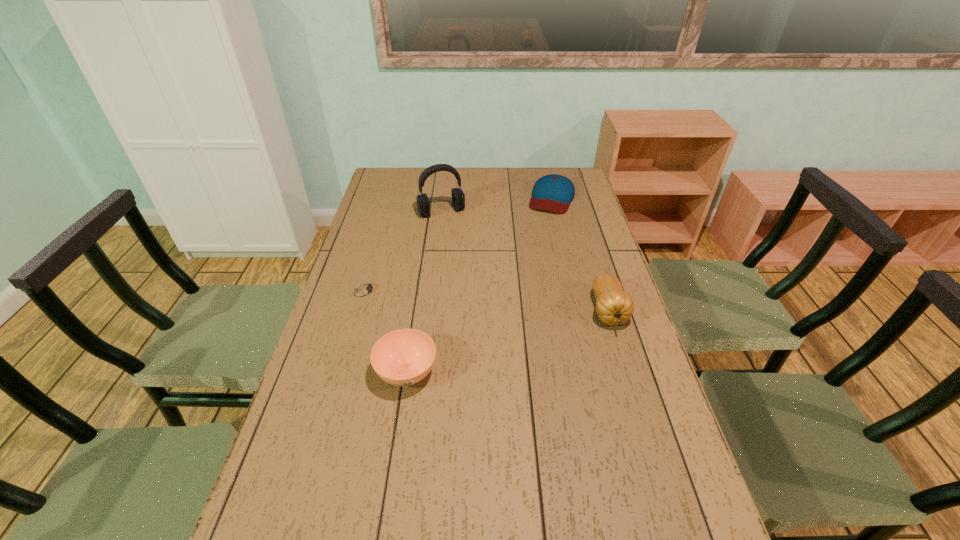
Identify the location of vacant region between the baseball cap and the leftmost object. This screenshot has width=960, height=540. (458, 244).

This screenshot has height=540, width=960. Find the location of `empty space between the watch and the baseball cap`. empty space between the watch and the baseball cap is located at coordinates (458, 244).

This screenshot has height=540, width=960. I want to click on free space between the tallest object and the baseball cap, so click(x=496, y=205).

The width and height of the screenshot is (960, 540). I want to click on vacant space that's between the nearest object and the headset, so click(424, 292).

Find the location of `free space between the nearest object and the tallest object`. free space between the nearest object and the tallest object is located at coordinates (424, 292).

This screenshot has width=960, height=540. I want to click on free space between the watch and the tallest object, so click(x=403, y=251).

Where is `the third closest object to the baseball cap`? the third closest object to the baseball cap is located at coordinates (365, 289).

This screenshot has width=960, height=540. Find the location of `object that stands as the third closest to the tallest object`. object that stands as the third closest to the tallest object is located at coordinates (614, 306).

Identify the location of free point that satisfies the following two spatial constraints: 1. on the front side of the soup bowl; 2. on the left side of the leftmost object. The image size is (960, 540). (341, 373).

Where is `vacant space that satisfies the following two spatial constraints: 1. on the front side of the shortest object; 2. on the right side of the soup bowl`? vacant space that satisfies the following two spatial constraints: 1. on the front side of the shortest object; 2. on the right side of the soup bowl is located at coordinates (341, 373).